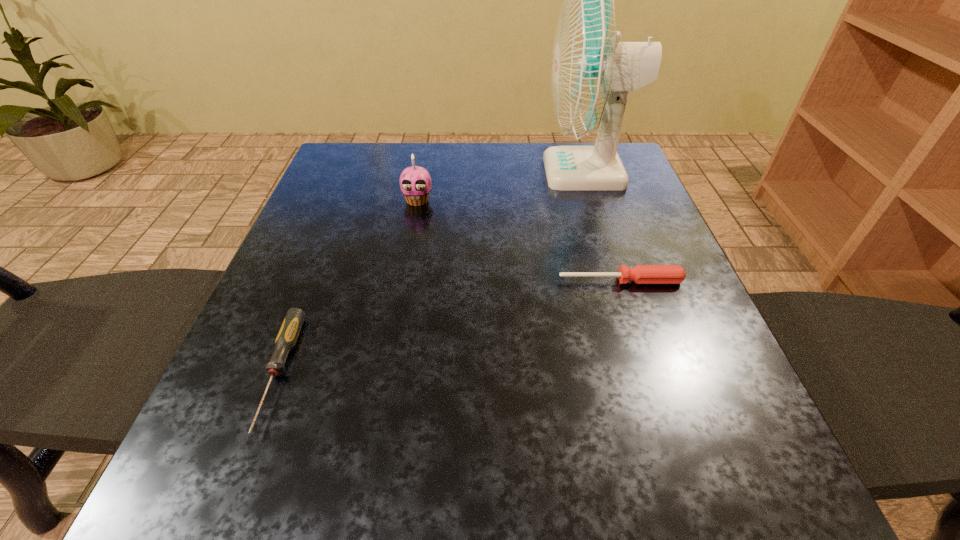
Find the location of a particular element. fan is located at coordinates (592, 72).

Find the location of `the third object from right to left`. the third object from right to left is located at coordinates (415, 182).

You are a GUI agent. You are given a task and a screenshot of the screen. Output one action in this format:
    pyautogui.click(x=<x>, y=<y>)
    Task: Click on the third shortest object
    
    Given the screenshot: What is the action you would take?
    pyautogui.click(x=415, y=182)

Where is `the right screwdriver`? the right screwdriver is located at coordinates tap(641, 274).

The image size is (960, 540). What are the coordinates of `the third farthest object` in the screenshot? It's located at pyautogui.click(x=641, y=274).

What are the coordinates of `the left screwdriver` in the screenshot? It's located at (286, 339).

Identify the location of the nearer screwdriver. (286, 339).

In order to click on vacant position located in front of the fan to face the airflow in this screenshot , I will do `click(503, 172)`.

You are a GUI agent. You are given a task and a screenshot of the screen. Output one action in this format:
    pyautogui.click(x=<x>, y=<y>)
    Task: Click on the free spot located 0.130m in front of the fan to face the airflow
    This screenshot has height=540, width=960.
    Given the screenshot: What is the action you would take?
    pyautogui.click(x=492, y=172)

Identify the location of vacant area located in front of the fan to face the airflow. (516, 172).